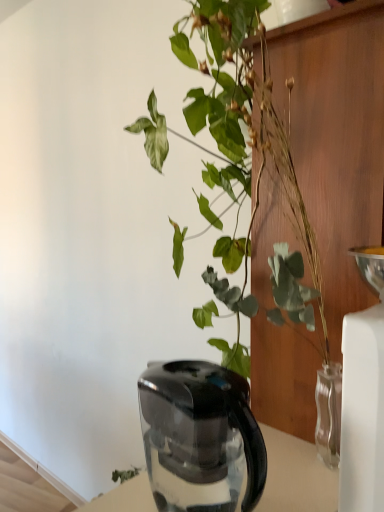
Where is `vacant area on top of black plastic kettle at lower center (from a real-world perspective)`? The width and height of the screenshot is (384, 512). vacant area on top of black plastic kettle at lower center (from a real-world perspective) is located at coordinates (196, 378).